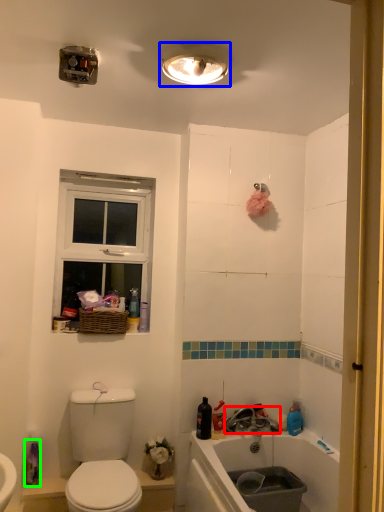
Question: Considering the real-world distances, which object is farthest from tap (highlighted by a red box)? light fixture (highlighted by a blue box) or cleaning product (highlighted by a green box)?

Choices:
 (A) light fixture
 (B) cleaning product

Answer: (A)